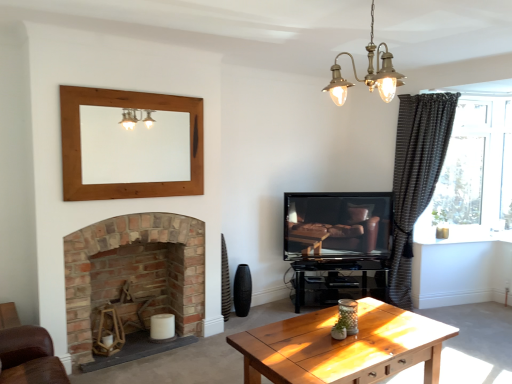
Question: From the image's perspective, is wooden mirror at upper center located above brass/textured chandelier at upper center?

Choices:
 (A) no
 (B) yes

Answer: (A)

Question: Is wooden mirror at upper center positioned with its back to brass/textured chandelier at upper center?

Choices:
 (A) yes
 (B) no

Answer: (B)

Question: Can you confirm if wooden mirror at upper center is positioned to the left of brass/textured chandelier at upper center?

Choices:
 (A) yes
 (B) no

Answer: (A)

Question: Does wooden mirror at upper center have a lesser height compared to brass/textured chandelier at upper center?

Choices:
 (A) yes
 (B) no

Answer: (B)

Question: Is wooden mirror at upper center placed right next to brass/textured chandelier at upper center?

Choices:
 (A) no
 (B) yes

Answer: (A)

Question: Does point (406, 183) appear closer or farther from the camera than point (367, 74)?

Choices:
 (A) closer
 (B) farther

Answer: (B)

Question: From their relative heights in the image, would you say dark grey textured curtain at right is taller or shorter than brass/textured chandelier at upper center?

Choices:
 (A) short
 (B) tall

Answer: (B)

Question: In terms of size, does dark grey textured curtain at right appear bigger or smaller than brass/textured chandelier at upper center?

Choices:
 (A) small
 (B) big

Answer: (B)

Question: Based on their positions, is dark grey textured curtain at right located to the left or right of brass/textured chandelier at upper center?

Choices:
 (A) left
 (B) right

Answer: (B)

Question: Is brick fireplace at lower left wider or thinner than matte black tv at center?

Choices:
 (A) thin
 (B) wide

Answer: (B)

Question: Is point (201, 297) positioned closer to the camera than point (325, 240)?

Choices:
 (A) closer
 (B) farther

Answer: (A)

Question: Relative to matte black tv at center, is brick fireplace at lower left in front or behind?

Choices:
 (A) front
 (B) behind

Answer: (A)

Question: Would you say brick fireplace at lower left is to the left or to the right of matte black tv at center in the picture?

Choices:
 (A) left
 (B) right

Answer: (A)

Question: Is brass/textured chandelier at upper center in front of or behind wooden mirror at upper center in the image?

Choices:
 (A) front
 (B) behind

Answer: (A)

Question: Does point click(x=352, y=56) appear closer or farther from the camera than point click(x=111, y=145)?

Choices:
 (A) closer
 (B) farther

Answer: (A)